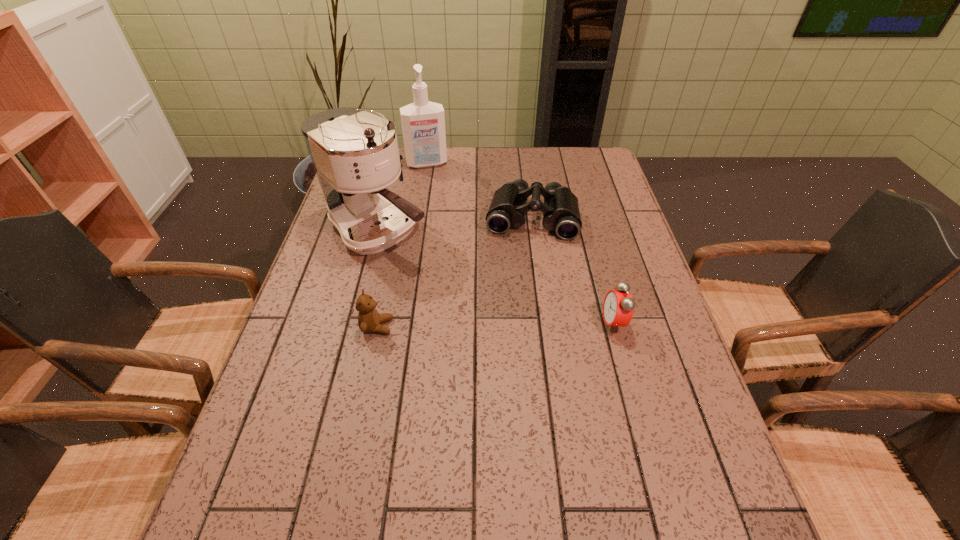
I want to click on alarm clock that is at the right edge, so click(x=618, y=307).

The width and height of the screenshot is (960, 540). In order to click on binoculars that is at the right edge in this screenshot , I will do `click(560, 209)`.

The image size is (960, 540). In order to click on vacant space at the far edge in this screenshot , I will do `click(436, 171)`.

Locate an element on the screen. vacant space at the near edge of the desktop is located at coordinates (344, 460).

Where is `vacant space at the left edge`? The height and width of the screenshot is (540, 960). vacant space at the left edge is located at coordinates (334, 249).

Locate an element on the screen. The image size is (960, 540). vacant region at the right edge is located at coordinates (584, 247).

At what (x,y) coordinates should I click in order to perform the action: click on free space between the alarm clock and the teddy bear. Please return your answer as a coordinate pair (x, y). The height and width of the screenshot is (540, 960). Looking at the image, I should click on (495, 325).

Where is `free space between the coffee maker and the teddy bear`? Image resolution: width=960 pixels, height=540 pixels. free space between the coffee maker and the teddy bear is located at coordinates (378, 279).

Locate an element on the screen. The image size is (960, 540). unoccupied area between the teddy bear and the coffee maker is located at coordinates (378, 279).

This screenshot has width=960, height=540. Find the location of `empty location between the alarm clock and the coffee maker`. empty location between the alarm clock and the coffee maker is located at coordinates (496, 277).